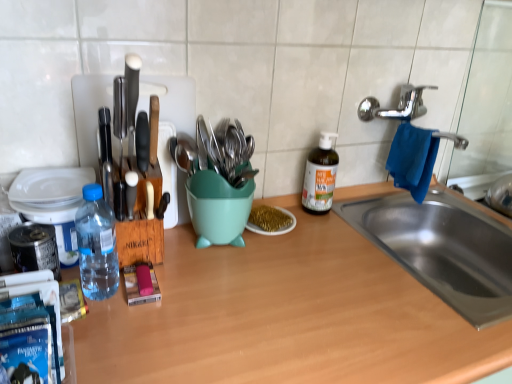
Question: Is metallic utensils at center thinner than green glass bottle at center, acting as the 2th bottle starting from the front?

Choices:
 (A) no
 (B) yes

Answer: (A)

Question: Can you confirm if metallic utensils at center is positioned to the left of green glass bottle at center, the first bottle when ordered from back to front?

Choices:
 (A) yes
 (B) no

Answer: (A)

Question: Is metallic utensils at center to the right of green glass bottle at center, acting as the 2th bottle starting from the front, from the viewer's perspective?

Choices:
 (A) yes
 (B) no

Answer: (B)

Question: Can you confirm if metallic utensils at center is taller than green glass bottle at center, marked as the first bottle in a right-to-left arrangement?

Choices:
 (A) no
 (B) yes

Answer: (A)

Question: From the image's perspective, does metallic utensils at center appear lower than green glass bottle at center, marked as the first bottle in a right-to-left arrangement?

Choices:
 (A) no
 (B) yes

Answer: (A)

Question: Does metallic utensils at center have a smaller size compared to green glass bottle at center, marked as the first bottle in a right-to-left arrangement?

Choices:
 (A) no
 (B) yes

Answer: (B)

Question: Is the depth of transparent plastic bottle at left, positioned as the first bottle in left-to-right order, greater than that of metallic utensils at center?

Choices:
 (A) no
 (B) yes

Answer: (A)

Question: Can you confirm if transparent plastic bottle at left, positioned as the first bottle in left-to-right order, is shorter than metallic utensils at center?

Choices:
 (A) yes
 (B) no

Answer: (B)

Question: Does transparent plastic bottle at left, positioned as the first bottle in left-to-right order, have a lesser width compared to metallic utensils at center?

Choices:
 (A) no
 (B) yes

Answer: (B)

Question: Considering the relative sizes of transparent plastic bottle at left, positioned as the first bottle in left-to-right order, and metallic utensils at center in the image provided, is transparent plastic bottle at left, positioned as the first bottle in left-to-right order, wider than metallic utensils at center?

Choices:
 (A) yes
 (B) no

Answer: (B)

Question: From a real-world perspective, is transparent plastic bottle at left, placed as the second bottle when sorted from back to front, positioned over metallic utensils at center based on gravity?

Choices:
 (A) no
 (B) yes

Answer: (A)

Question: From a real-world perspective, is transparent plastic bottle at left, which is counted as the 2th bottle, starting from the right, below metallic utensils at center?

Choices:
 (A) yes
 (B) no

Answer: (A)

Question: From the image's perspective, is green glass bottle at center, marked as the first bottle in a right-to-left arrangement, above blue fabric hand towel at sink right?

Choices:
 (A) yes
 (B) no

Answer: (B)